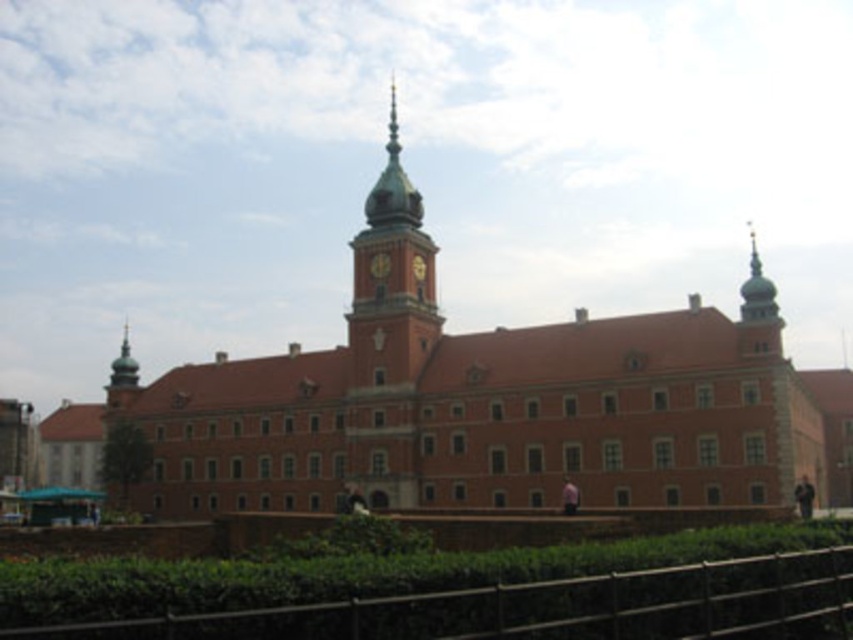
Question: Which object is the closest to the gold metallic clock at center?

Choices:
 (A) brown wooden fence at lower center
 (B) golden metallic clock at center

Answer: (B)

Question: Does brown wooden fence at lower center appear on the right side of golden metallic clock at center?

Choices:
 (A) no
 (B) yes

Answer: (B)

Question: Is brown wooden fence at lower center smaller than golden metallic clock at center?

Choices:
 (A) no
 (B) yes

Answer: (A)

Question: Where is brown wooden fence at lower center located in relation to golden metallic clock at center in the image?

Choices:
 (A) left
 (B) right

Answer: (B)

Question: Which point is closer to the camera?

Choices:
 (A) brown wooden fence at lower center
 (B) gold metallic clock at center

Answer: (A)

Question: Which object is positioned closest to the gold metallic clock at center?

Choices:
 (A) golden metallic clock at center
 (B) brown wooden fence at lower center

Answer: (A)